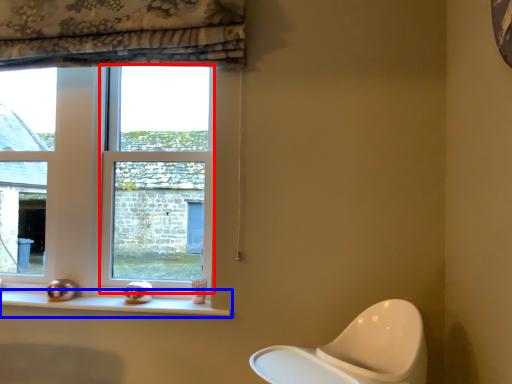
Question: Which object is further to the camera taking this photo, window (highlighted by a red box) or window sill (highlighted by a blue box)?

Choices:
 (A) window
 (B) window sill

Answer: (A)